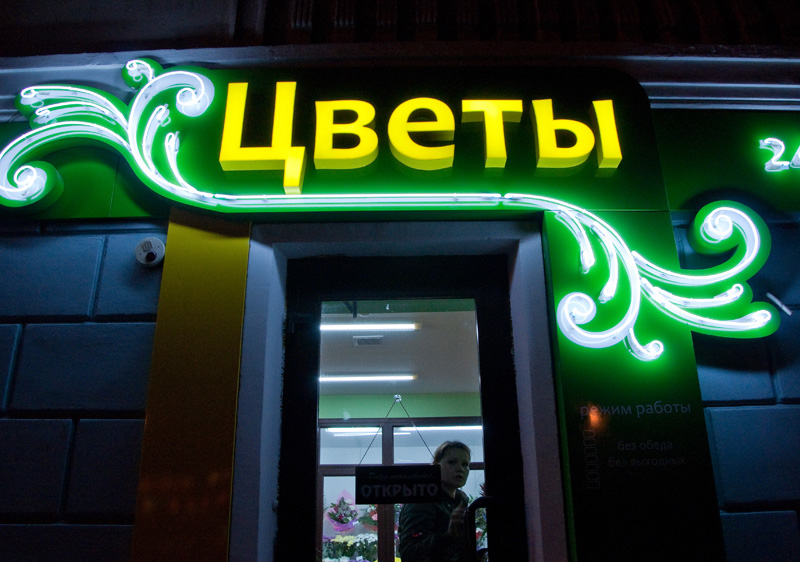
You are a GUI agent. You are given a task and a screenshot of the screen. Output one action in this format:
    pyautogui.click(x=<x>, y=<y>)
    Task: Click on the brick wall right of entrance
    The image size is (800, 562).
    Given the screenshot: What is the action you would take?
    pyautogui.click(x=109, y=341)